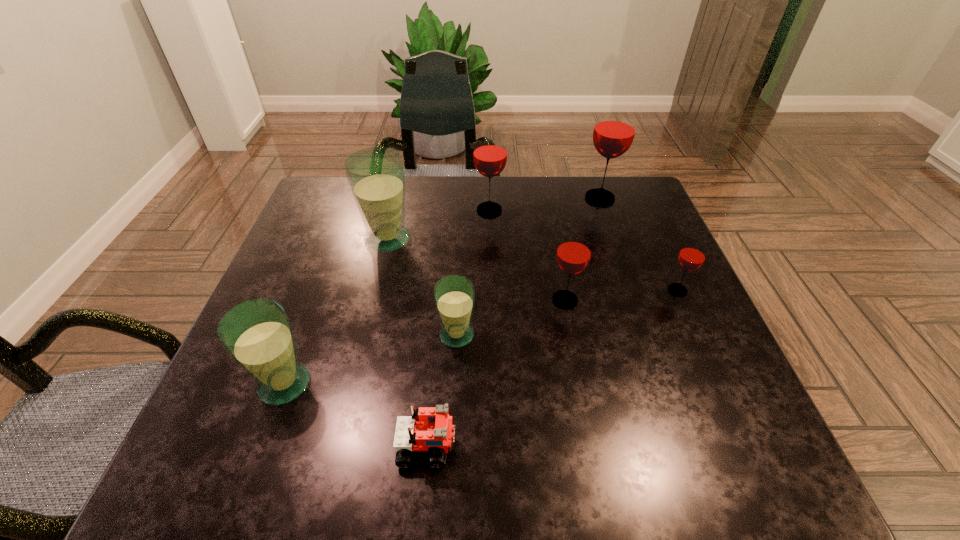
Locate an element on the screen. This screenshot has height=540, width=960. free space located on the back of the smallest red glass is located at coordinates (639, 205).

The height and width of the screenshot is (540, 960). What are the coordinates of `vacant area situated 0.360m on the back of the sixth farthest object` in the screenshot? It's located at tap(463, 219).

You are a GUI agent. You are given a task and a screenshot of the screen. Output one action in this format:
    pyautogui.click(x=<x>, y=<y>)
    Task: Click on the vacant region located on the front-facing side of the nearest object
    
    Given the screenshot: What is the action you would take?
    pyautogui.click(x=683, y=446)

What are the coordinates of `object located at the near edge` in the screenshot? It's located at (430, 428).

Identify the location of object that is at the left edge. The image size is (960, 540). (257, 334).

This screenshot has height=540, width=960. I want to click on object that is positioned at the far right corner, so click(x=614, y=131).

Identify the location of vacant region at the far edge. (456, 199).

The height and width of the screenshot is (540, 960). What are the coordinates of `free location at the near edge of the desktop` in the screenshot? It's located at (544, 443).

This screenshot has height=540, width=960. Find the location of `vacant area at the left edge`. vacant area at the left edge is located at coordinates (315, 250).

Identify the location of free spot at the far left corner of the desktop. (318, 224).